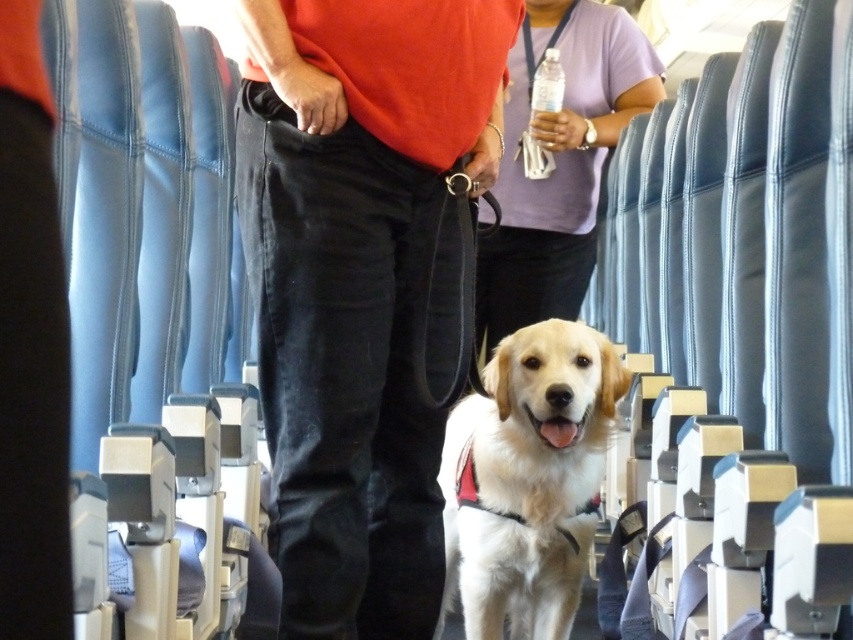
Question: Which object appears closest to the camera in this image?

Choices:
 (A) purple fabric shirt at center
 (B) clear plastic bottle at upper center
 (C) white fur dog at center
 (D) matte black pants at center

Answer: (D)

Question: Does matte black pants at center appear on the right side of purple fabric shirt at center?

Choices:
 (A) yes
 (B) no

Answer: (B)

Question: Is purple fabric shirt at center positioned behind clear plastic bottle at upper center?

Choices:
 (A) no
 (B) yes

Answer: (A)

Question: Which point appears closest to the camera in this image?

Choices:
 (A) (550, 60)
 (B) (535, 200)
 (C) (328, 349)
 (D) (486, 461)

Answer: (C)

Question: Is matte black pants at center wider than white fur dog at center?

Choices:
 (A) yes
 (B) no

Answer: (A)

Question: Which object is positioned closest to the matte black pants at center?

Choices:
 (A) white fur dog at center
 (B) purple fabric shirt at center
 (C) clear plastic bottle at upper center

Answer: (A)